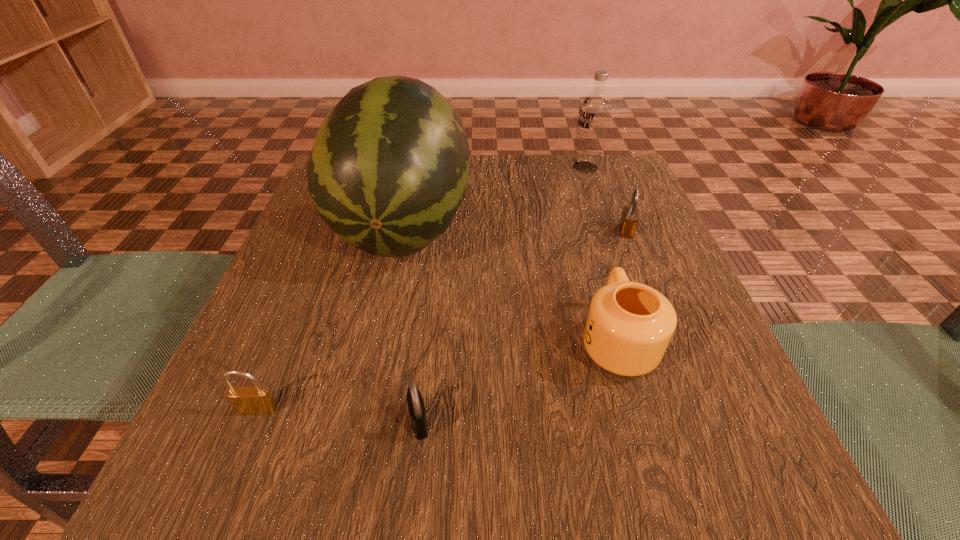
At what (x,y) coordinates should I click in order to perform the action: click on vacant space that is in between the second tallest object and the second padlock from right to left. Please return your answer as a coordinate pair (x, y). The image size is (960, 540). Looking at the image, I should click on (502, 294).

The width and height of the screenshot is (960, 540). Find the location of `unoccupied area between the second padlock from left to right and the leftmost padlock`. unoccupied area between the second padlock from left to right and the leftmost padlock is located at coordinates (339, 416).

Where is `object that is the closest to the rightmost padlock`? The image size is (960, 540). object that is the closest to the rightmost padlock is located at coordinates (629, 325).

I want to click on the second closest object to the fourth shortest object, so click(629, 219).

Locate which padlock is the second closest to the second padlock from right to left. Please provide its 2D coordinates. Your answer should be formatted as a tuple, i.e. [(x, y)], where the tuple contains the x and y coordinates of a point satisfying the conditions above.

[(629, 219)]

You are a GUI agent. You are given a task and a screenshot of the screen. Output one action in this format:
    pyautogui.click(x=<x>, y=<y>)
    Task: Click on the padlock that is the third closest to the tallest object
    
    Given the screenshot: What is the action you would take?
    pyautogui.click(x=629, y=219)

Identify the location of free space that satisfies the following two spatial constraints: 1. on the front label of the vodka; 2. on the front-facing side of the leftmost padlock. This screenshot has height=540, width=960. (669, 409).

The width and height of the screenshot is (960, 540). Find the location of `vacant area in the image that satisfies the following two spatial constraints: 1. on the front label of the rightmost padlock; 2. on the left side of the fifth shortest object`. vacant area in the image that satisfies the following two spatial constraints: 1. on the front label of the rightmost padlock; 2. on the left side of the fifth shortest object is located at coordinates (608, 231).

Identify the location of free region that satisfies the following two spatial constraints: 1. on the front side of the farthest padlock; 2. on the left side of the watermelon. (400, 231).

Find the location of a particular element. This screenshot has height=540, width=960. free location that satisfies the following two spatial constraints: 1. on the front label of the vodka; 2. on the back side of the farthest padlock is located at coordinates (608, 231).